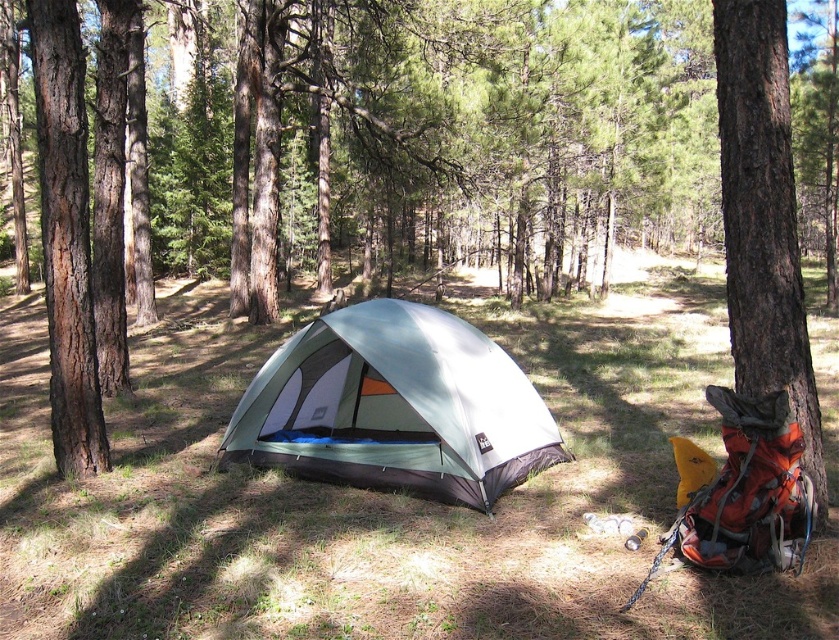
Question: Which point is farther to the camera?

Choices:
 (A) brown rough bark tree at right
 (B) brown rough bark tree at left

Answer: (B)

Question: Is brown rough bark tree at right below brown rough bark tree at left?

Choices:
 (A) no
 (B) yes

Answer: (B)

Question: Which object is the closest to the brown rough bark tree at right?

Choices:
 (A) brown rough bark tree at left
 (B) green fabric tent at center

Answer: (B)

Question: Which point appears closest to the camera in this image?

Choices:
 (A) (357, 339)
 (B) (725, 202)
 (C) (74, 156)

Answer: (B)

Question: Is brown rough bark tree at right smaller than brown rough bark tree at left?

Choices:
 (A) no
 (B) yes

Answer: (B)

Question: Is the position of brown rough bark tree at right less distant than that of brown rough bark tree at left?

Choices:
 (A) no
 (B) yes

Answer: (B)